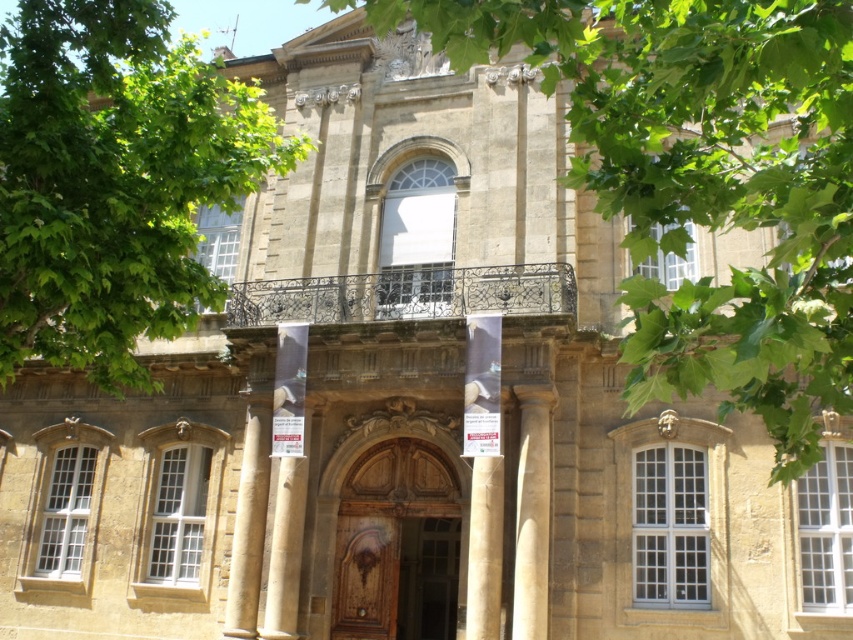
Who is more distant from viewer, (535, 598) or (431, 524)?

The point (431, 524) is behind.

Is point (525, 504) farther from camera compared to point (442, 540)?

That is False.

Between point (537, 419) and point (421, 625), which one is positioned behind?

The point (421, 625) is more distant.

The image size is (853, 640). I want to click on smooth stone column at center, so click(532, 513).

Does green leafy tree at center appear under wooden door at center?

No.

What do you see at coordinates (701, 179) in the screenshot?
I see `green leafy tree at center` at bounding box center [701, 179].

The image size is (853, 640). Find the location of `green leafy tree at center`. green leafy tree at center is located at coordinates (701, 179).

Which is in front, point (253, 500) or point (491, 500)?

Point (491, 500)

Who is more distant from viewer, (236, 600) or (479, 492)?

Positioned behind is point (236, 600).

Where is `beige stone column at center`? beige stone column at center is located at coordinates (248, 524).